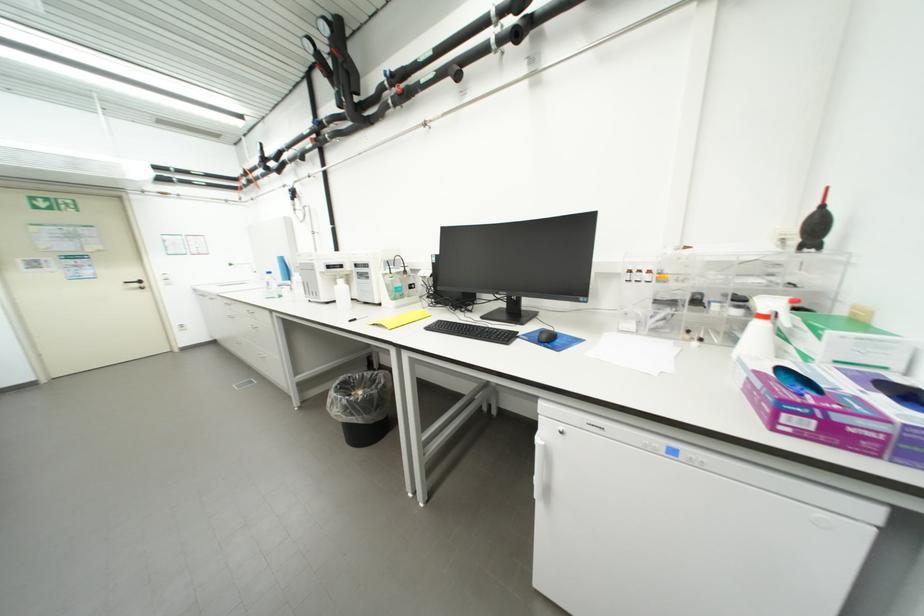
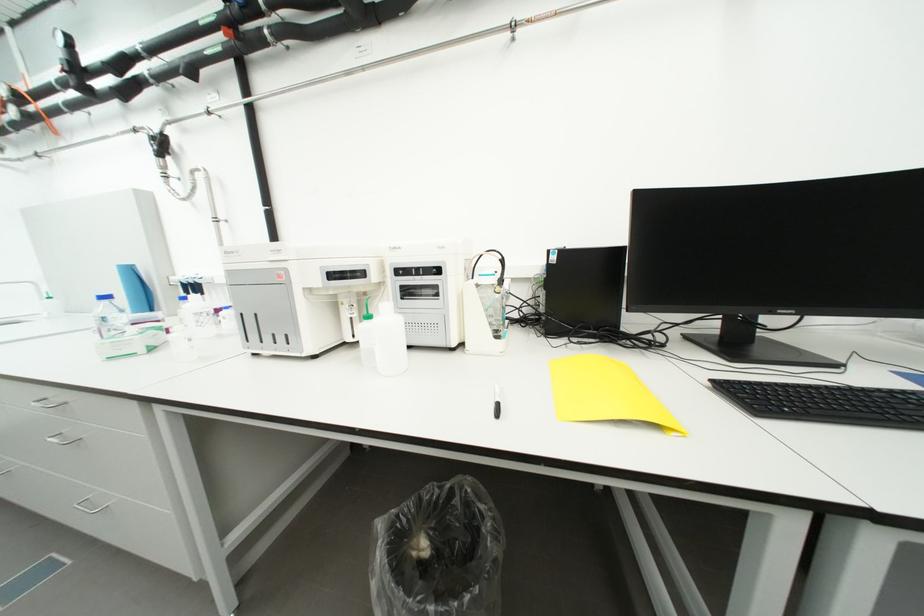
In a continuous first-person perspective shot, in which direction is the camera moving?

The cameraman moved toward left, forward.